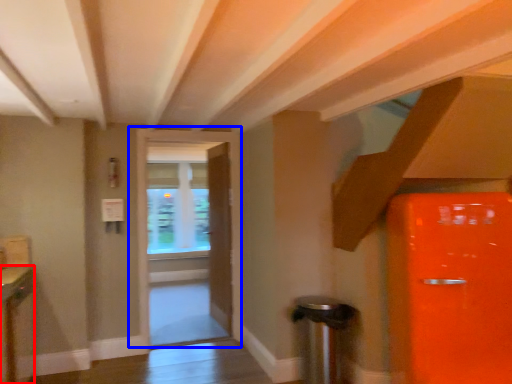
Question: Which object appears farthest to the camera in this image, cabinetry (highlighted by a red box) or door (highlighted by a blue box)?

Choices:
 (A) cabinetry
 (B) door

Answer: (B)